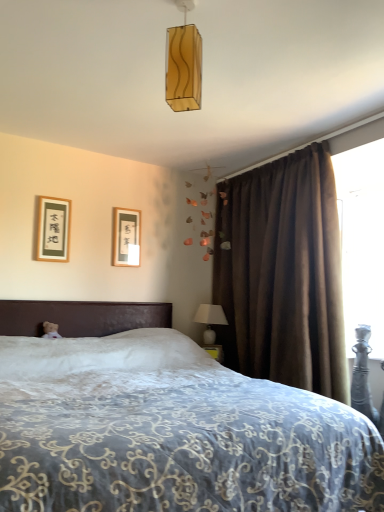
Question: Is white plush teddy bear at left smaller than brown velvet curtain at right?

Choices:
 (A) no
 (B) yes

Answer: (B)

Question: Is white plush teddy bear at left further to camera compared to brown velvet curtain at right?

Choices:
 (A) no
 (B) yes

Answer: (B)

Question: Is white plush teddy bear at left not within brown velvet curtain at right?

Choices:
 (A) yes
 (B) no

Answer: (A)

Question: Is white plush teddy bear at left shorter than brown velvet curtain at right?

Choices:
 (A) yes
 (B) no

Answer: (A)

Question: Considering the relative sizes of white plush teddy bear at left and brown velvet curtain at right in the image provided, is white plush teddy bear at left taller than brown velvet curtain at right?

Choices:
 (A) yes
 (B) no

Answer: (B)

Question: Is transparent plastic screen at upper right bigger or smaller than white ceramic table lamp at right?

Choices:
 (A) small
 (B) big

Answer: (B)

Question: Is transparent plastic screen at upper right spatially inside white ceramic table lamp at right, or outside of it?

Choices:
 (A) inside
 (B) outside

Answer: (B)

Question: From the image's perspective, is transparent plastic screen at upper right positioned above or below white ceramic table lamp at right?

Choices:
 (A) above
 (B) below

Answer: (A)

Question: In terms of width, does transparent plastic screen at upper right look wider or thinner when compared to white ceramic table lamp at right?

Choices:
 (A) wide
 (B) thin

Answer: (B)

Question: Is matte black picture frame at upper left, which is counted as the 2th picture frame, starting from the back, wider or thinner than white plush teddy bear at left?

Choices:
 (A) thin
 (B) wide

Answer: (A)

Question: From the image's perspective, is matte black picture frame at upper left, which is counted as the second picture frame, starting from the right, positioned above or below white plush teddy bear at left?

Choices:
 (A) below
 (B) above

Answer: (B)

Question: Is matte black picture frame at upper left, which is counted as the 2th picture frame, starting from the back, to the left or to the right of white plush teddy bear at left in the image?

Choices:
 (A) right
 (B) left

Answer: (B)

Question: Is matte black picture frame at upper left, the first picture frame from the left, in front of or behind white plush teddy bear at left in the image?

Choices:
 (A) behind
 (B) front

Answer: (A)

Question: Is white plush teddy bear at left taller or shorter than matte black picture frame at upper left, which is the first picture frame in front-to-back order?

Choices:
 (A) tall
 (B) short

Answer: (B)

Question: Considering the positions of point (51, 330) and point (59, 230), is point (51, 330) closer or farther from the camera than point (59, 230)?

Choices:
 (A) closer
 (B) farther

Answer: (A)